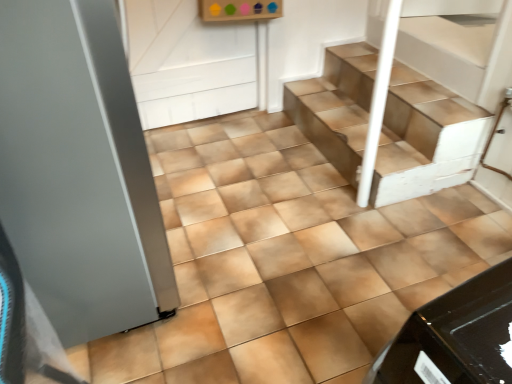
What do you see at coordinates (425, 138) in the screenshot? This screenshot has height=384, width=512. I see `brown tile stairs at center` at bounding box center [425, 138].

Measure the distance between brown tile stairs at center and camera.

brown tile stairs at center is 5.85 feet away from camera.

Identify the location of brown tile stairs at center. (425, 138).

Where is `brown tile stairs at center`? The image size is (512, 384). brown tile stairs at center is located at coordinates (425, 138).